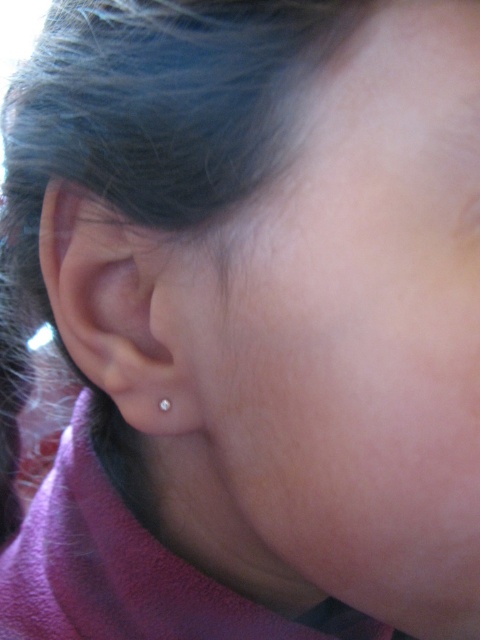
Question: Which object appears closest to the camera in this image?

Choices:
 (A) pearl-like earring at ear
 (B) clear gold earring at left

Answer: (B)

Question: Which point appears closest to the camera in this image?

Choices:
 (A) (148, 426)
 (B) (166, 397)

Answer: (B)

Question: Among these objects, which one is farthest from the camera?

Choices:
 (A) clear gold earring at left
 (B) pearl-like earring at ear

Answer: (B)

Question: Does clear gold earring at left appear over pearl-like earring at ear?

Choices:
 (A) yes
 (B) no

Answer: (A)

Question: Does clear gold earring at left have a greater width compared to pearl-like earring at ear?

Choices:
 (A) yes
 (B) no

Answer: (A)

Question: Does clear gold earring at left appear on the left side of pearl-like earring at ear?

Choices:
 (A) yes
 (B) no

Answer: (A)